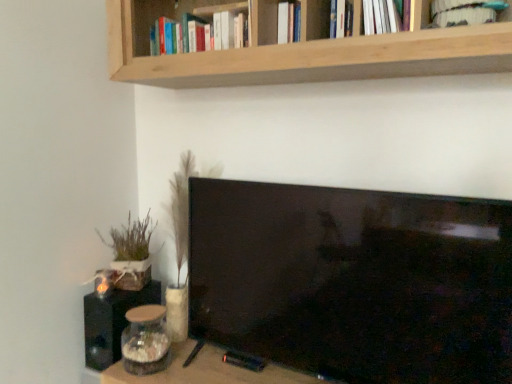
Question: Could you tell me if white fabric book at upper right, the 1th book from the right, is facing wooden table at lower center?

Choices:
 (A) no
 (B) yes

Answer: (A)

Question: From a real-world perspective, is white fabric book at upper right, the 1th book from the right, beneath wooden table at lower center?

Choices:
 (A) yes
 (B) no

Answer: (B)

Question: Is white fabric book at upper right, which is the second book in left-to-right order, not near wooden table at lower center?

Choices:
 (A) no
 (B) yes

Answer: (B)

Question: Is white fabric book at upper right, marked as the first book in a front-to-back arrangement, turned away from wooden table at lower center?

Choices:
 (A) yes
 (B) no

Answer: (B)

Question: Is white fabric book at upper right, the 1th book from the right, taller than wooden table at lower center?

Choices:
 (A) no
 (B) yes

Answer: (A)

Question: Considering the relative positions of white fabric book at upper right, marked as the first book in a front-to-back arrangement, and wooden table at lower center in the image provided, is white fabric book at upper right, marked as the first book in a front-to-back arrangement, behind wooden table at lower center?

Choices:
 (A) yes
 (B) no

Answer: (B)

Question: Considering the relative positions of wooden box at left and black matte speaker at lower left in the image provided, is wooden box at left behind black matte speaker at lower left?

Choices:
 (A) yes
 (B) no

Answer: (A)

Question: Can you confirm if wooden box at left is positioned to the left of black matte speaker at lower left?

Choices:
 (A) yes
 (B) no

Answer: (B)

Question: Can you confirm if wooden box at left is shorter than black matte speaker at lower left?

Choices:
 (A) no
 (B) yes

Answer: (B)

Question: Is wooden box at left positioned far away from black matte speaker at lower left?

Choices:
 (A) yes
 (B) no

Answer: (B)

Question: Is wooden box at left at the right side of black matte speaker at lower left?

Choices:
 (A) no
 (B) yes

Answer: (B)

Question: From a real-world perspective, is wooden box at left positioned under black matte speaker at lower left based on gravity?

Choices:
 (A) no
 (B) yes

Answer: (A)

Question: Does wooden table at lower center come behind white fabric book at upper right, placed as the second book when sorted from back to front?

Choices:
 (A) yes
 (B) no

Answer: (A)